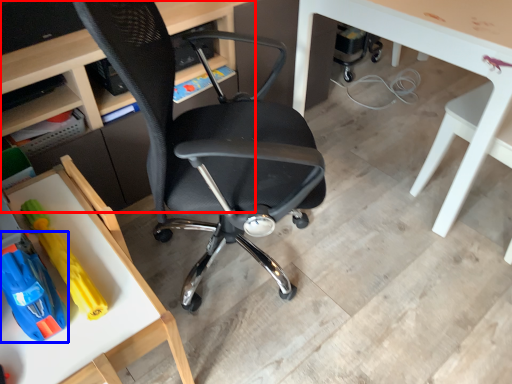
Question: Among these objects, which one is farthest to the camera, desk (highlighted by a red box) or toy (highlighted by a blue box)?

Choices:
 (A) desk
 (B) toy

Answer: (A)